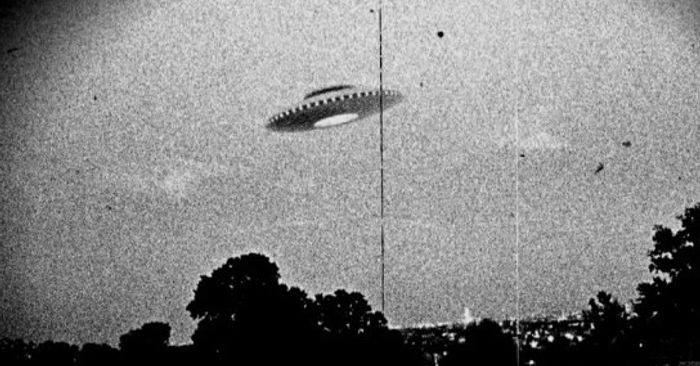
Where is `dark corners`? This screenshot has height=366, width=700. dark corners is located at coordinates (15, 27), (687, 11), (7, 358), (693, 357).